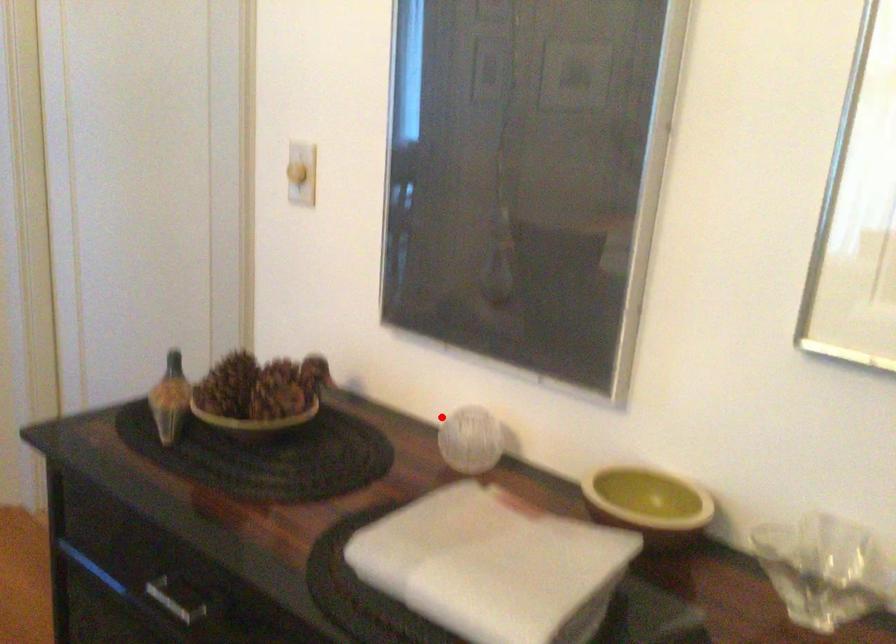
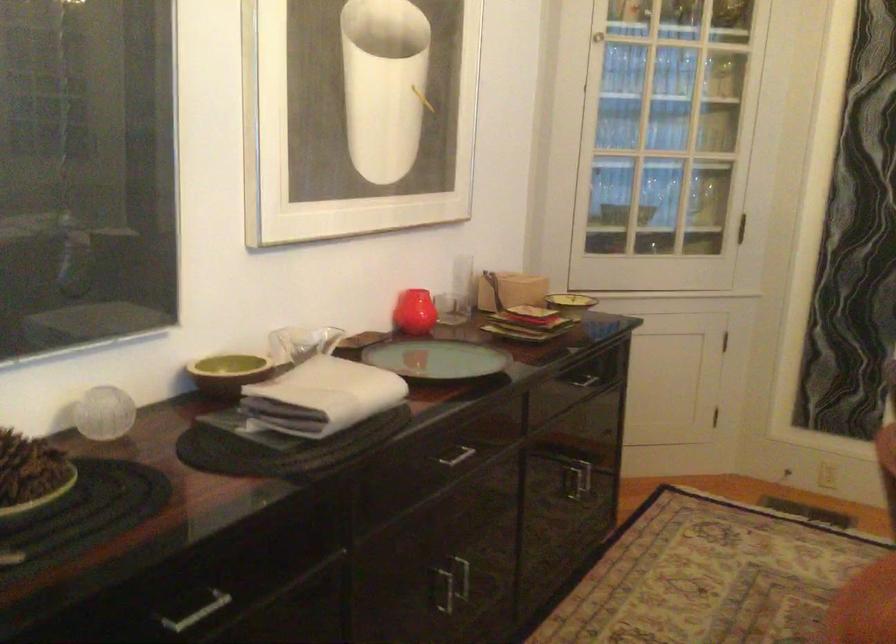
Locate, in the second image, the point that corresponds to the highlighted location in the first image.

(104, 413)